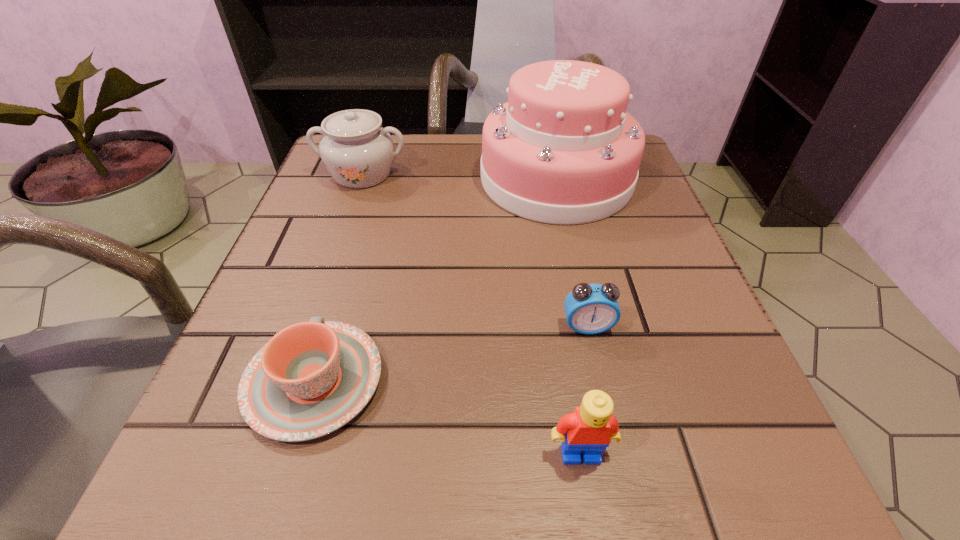
The width and height of the screenshot is (960, 540). What are the coordinates of `vacant region located on the handle side of the shortest object` in the screenshot? It's located at (340, 297).

At what (x,y) coordinates should I click in order to perform the action: click on free space located on the handle side of the shortest object. Please return your answer as a coordinate pair (x, y). Looking at the image, I should click on (370, 198).

At what (x,y) coordinates should I click in order to perform the action: click on cake that is positioned at the far edge. Please return your answer as a coordinate pair (x, y). This screenshot has height=540, width=960. Looking at the image, I should click on (563, 150).

Where is `chinaware located in the far edge section of the desktop`? This screenshot has height=540, width=960. chinaware located in the far edge section of the desktop is located at coordinates (358, 152).

Where is `Lego at the near edge`? Lego at the near edge is located at coordinates (590, 428).

The image size is (960, 540). What are the coordinates of `chinaware situated at the near edge` in the screenshot? It's located at (312, 378).

Identify the location of cake that is at the right edge. Image resolution: width=960 pixels, height=540 pixels. (563, 150).

Locate an element on the screen. The image size is (960, 540). alarm clock located at the right edge is located at coordinates click(590, 309).

Where is `object positioned at the far left corner`? object positioned at the far left corner is located at coordinates click(358, 152).

I want to click on object present at the near left corner, so click(x=312, y=378).